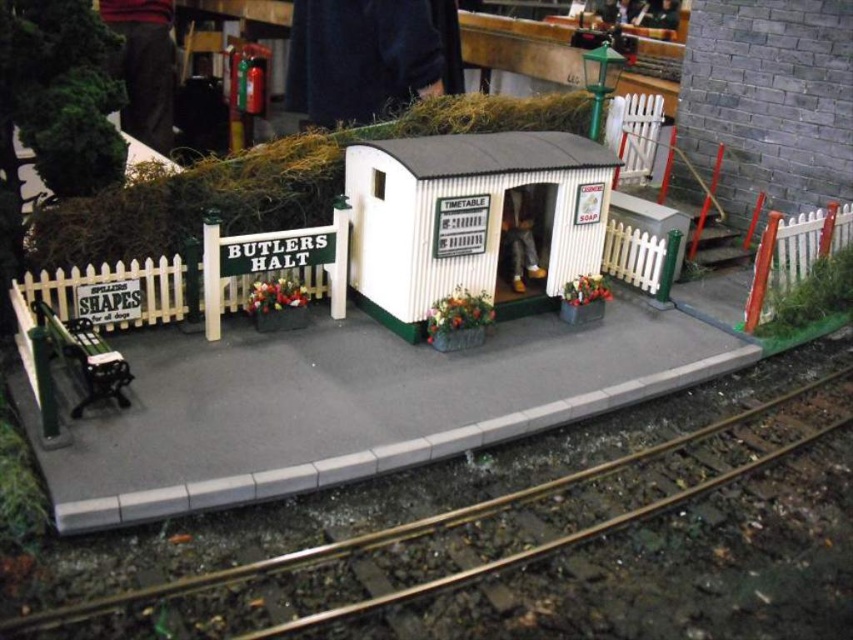
Question: Which point appears farthest from the camera in this image?

Choices:
 (A) (648, 449)
 (B) (358, 289)

Answer: (B)

Question: Can you confirm if white corrugated metal hut at center is positioned above metallic gold track at lower center?

Choices:
 (A) yes
 (B) no

Answer: (A)

Question: Which point is closer to the camera?

Choices:
 (A) (567, 132)
 (B) (724, 474)

Answer: (B)

Question: Is the position of white corrugated metal hut at center more distant than that of metallic gold track at lower center?

Choices:
 (A) no
 (B) yes

Answer: (B)

Question: Can you confirm if white corrugated metal hut at center is positioned below metallic gold track at lower center?

Choices:
 (A) no
 (B) yes

Answer: (A)

Question: Which of the following is the closest to the observer?

Choices:
 (A) white corrugated metal hut at center
 (B) metallic gold track at lower center

Answer: (B)